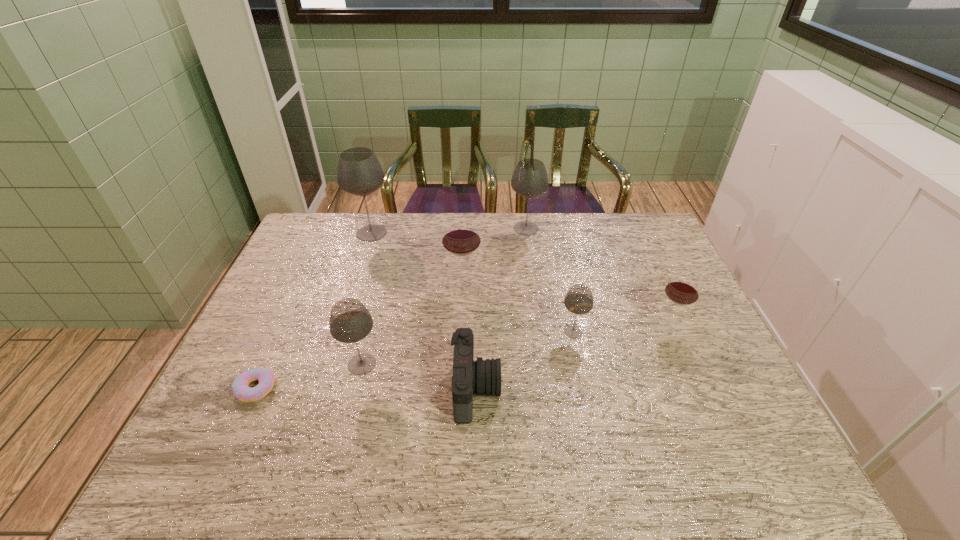
Where is `the biggest gray wineglass`? The image size is (960, 540). the biggest gray wineglass is located at coordinates (359, 172).

Identify the location of the tallest object. This screenshot has height=540, width=960. (359, 172).

At what (x,y) coordinates should I click in order to perform the action: click on the second tallest object. Please return your answer as a coordinate pair (x, y). The image size is (960, 540). Looking at the image, I should click on (529, 179).

Identify the location of the third smallest gray wineglass. This screenshot has width=960, height=540. (529, 179).

This screenshot has height=540, width=960. I want to click on the left red wineglass, so [x=461, y=237].

The image size is (960, 540). Find the location of `the fourth nearest wineglass`. the fourth nearest wineglass is located at coordinates (461, 237).

Where is `the nearest gray wineglass`? Image resolution: width=960 pixels, height=540 pixels. the nearest gray wineglass is located at coordinates (350, 321).

Image resolution: width=960 pixels, height=540 pixels. Identify the location of the third biggest gray wineglass. (350, 321).

The width and height of the screenshot is (960, 540). I want to click on the rightmost wineglass, so pyautogui.click(x=682, y=289).

Image resolution: width=960 pixels, height=540 pixels. What are the coordinates of `the nearer red wineglass` in the screenshot? It's located at (682, 289).